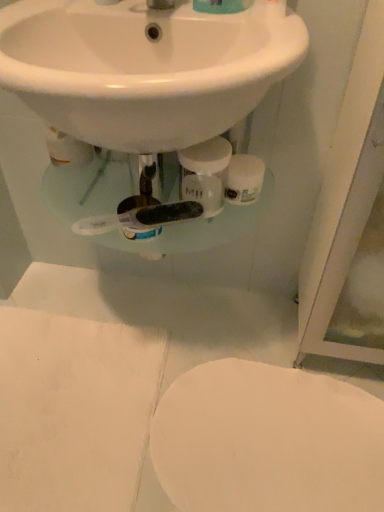
Question: From a real-world perspective, is white glossy sink at upper center on white glossy toilet at lower right?

Choices:
 (A) yes
 (B) no

Answer: (A)

Question: Is white glossy sink at upper center positioned in front of white glossy toilet at lower right?

Choices:
 (A) yes
 (B) no

Answer: (A)

Question: Is white glossy sink at upper center to the right of white glossy toilet at lower right from the viewer's perspective?

Choices:
 (A) yes
 (B) no

Answer: (B)

Question: Is white glossy sink at upper center thinner than white glossy toilet at lower right?

Choices:
 (A) no
 (B) yes

Answer: (A)

Question: Is white glossy sink at upper center positioned beyond the bounds of white glossy toilet at lower right?

Choices:
 (A) no
 (B) yes

Answer: (B)

Question: Can you confirm if white glossy sink at upper center is shorter than white glossy toilet at lower right?

Choices:
 (A) no
 (B) yes

Answer: (A)

Question: Is white matte toilet paper at center completely or partially outside of white glossy sink at upper center?

Choices:
 (A) no
 (B) yes

Answer: (B)

Question: From a real-world perspective, is white matte toilet paper at center positioned over white glossy sink at upper center based on gravity?

Choices:
 (A) yes
 (B) no

Answer: (B)

Question: Can you confirm if white matte toilet paper at center is wider than white glossy sink at upper center?

Choices:
 (A) no
 (B) yes

Answer: (A)

Question: Is white glossy sink at upper center a part of white matte toilet paper at center?

Choices:
 (A) no
 (B) yes

Answer: (A)

Question: Is white matte toilet paper at center positioned with its back to white glossy sink at upper center?

Choices:
 (A) yes
 (B) no

Answer: (B)

Question: Does white matte toilet paper at center turn towards white glossy sink at upper center?

Choices:
 (A) yes
 (B) no

Answer: (B)

Question: Is white glossy toilet at lower right looking in the opposite direction of white glossy sink at upper center?

Choices:
 (A) no
 (B) yes

Answer: (A)